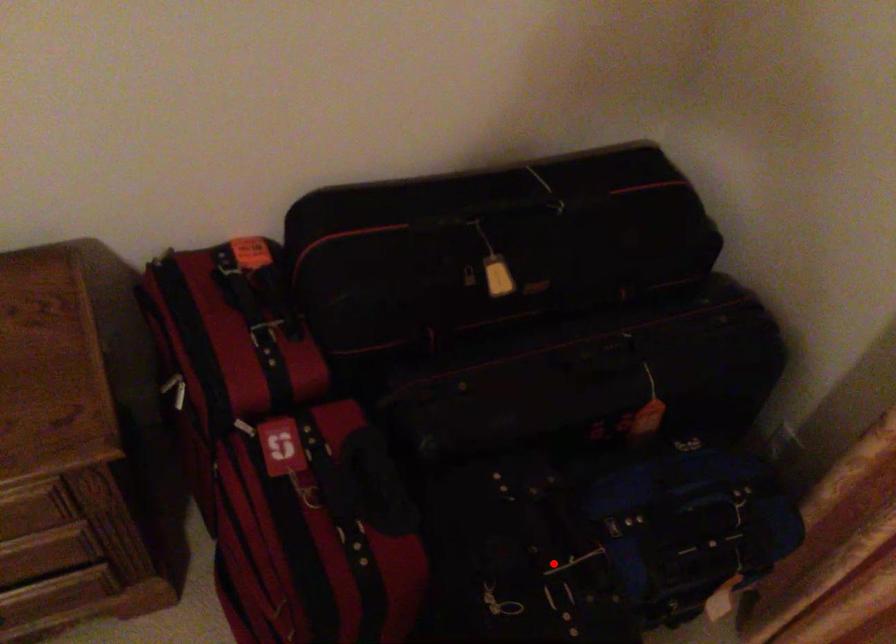
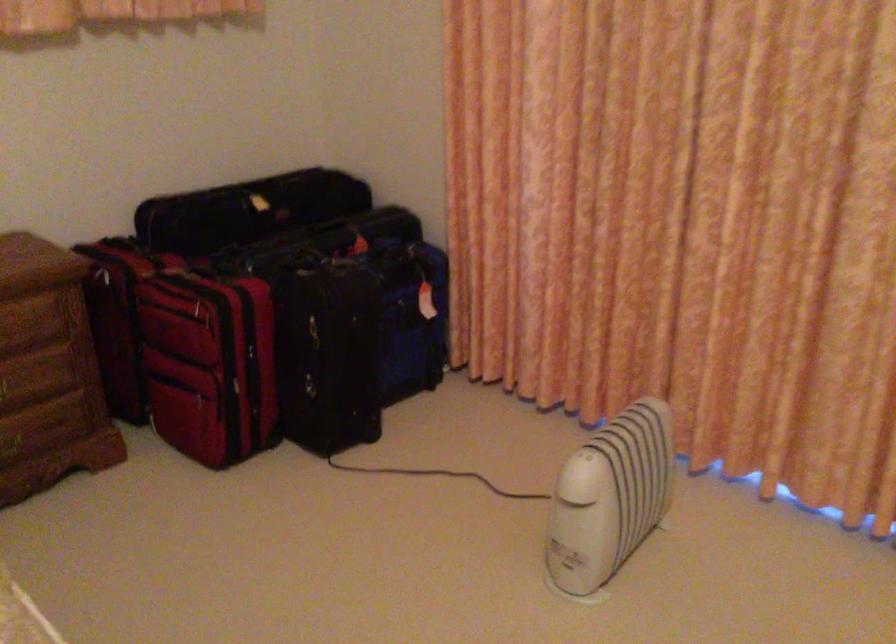
Where in the second image is the point corresponding to the highlighted location from the first image?

(330, 266)